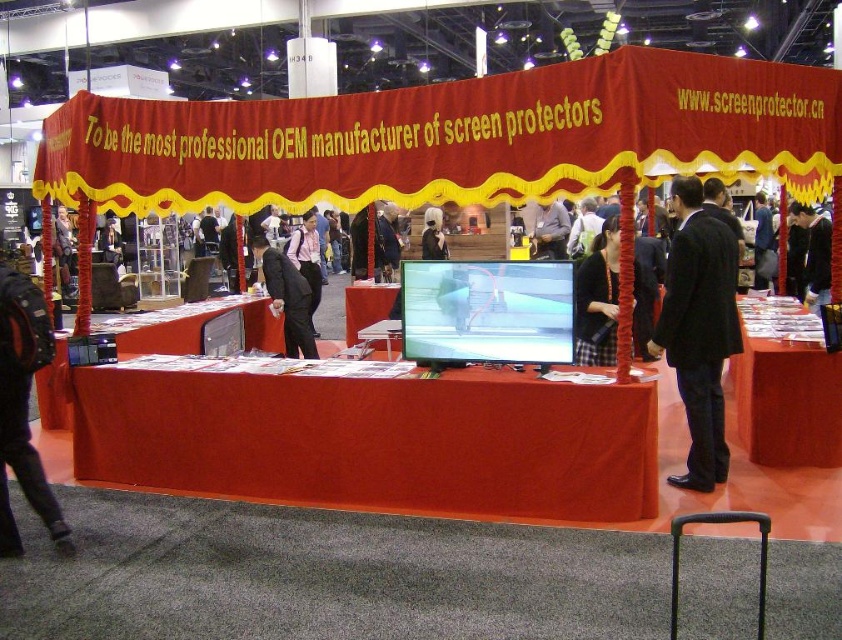
You are setting up a trade show booth and need to place a large promotional banner between the matte red table at center and the black fabric at center. Which object should you place the banner next to to ensure it fits horizontally?

The matte red table at center is wider than the black fabric at center, so placing the banner next to the matte red table at center would provide enough space for it to fit horizontally.

You are a visitor at the trade show booth. You see the smooth glossy table at center and the dark suit at center. Which object is bigger in size?

The smooth glossy table at center has a larger size compared to the dark suit at center.

Consider the image. You are at the trade show booth and see two items labeled as black fabric coat at center and black fabric at center. Which one is positioned to the right of the other?

The black fabric coat at center is positioned to the right of the black fabric at center.